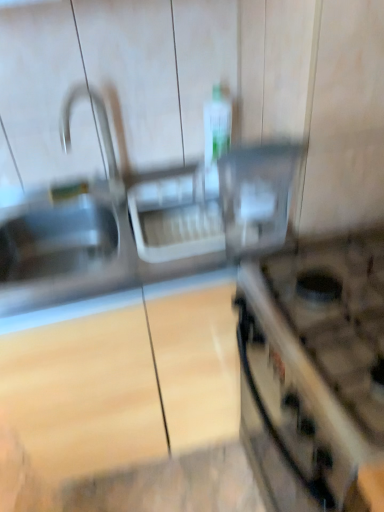
Question: Does clear plastic container at center turn towards satin nickel faucet at upper left?

Choices:
 (A) yes
 (B) no

Answer: (B)

Question: Can you confirm if clear plastic container at center is positioned to the right of satin nickel faucet at upper left?

Choices:
 (A) yes
 (B) no

Answer: (A)

Question: Does clear plastic container at center appear on the left side of satin nickel faucet at upper left?

Choices:
 (A) no
 (B) yes

Answer: (A)

Question: Considering the relative sizes of clear plastic container at center and satin nickel faucet at upper left in the image provided, is clear plastic container at center shorter than satin nickel faucet at upper left?

Choices:
 (A) yes
 (B) no

Answer: (A)

Question: Is clear plastic container at center next to satin nickel faucet at upper left and touching it?

Choices:
 (A) yes
 (B) no

Answer: (B)

Question: Is clear plastic container at center in front of or behind satin nickel faucet at upper left in the image?

Choices:
 (A) front
 (B) behind

Answer: (A)

Question: From the image's perspective, is clear plastic container at center positioned above or below satin nickel faucet at upper left?

Choices:
 (A) below
 (B) above

Answer: (A)

Question: Looking at their shapes, would you say clear plastic container at center is wider or thinner than satin nickel faucet at upper left?

Choices:
 (A) thin
 (B) wide

Answer: (A)

Question: Is clear plastic container at center situated inside satin nickel faucet at upper left or outside?

Choices:
 (A) inside
 (B) outside

Answer: (B)

Question: Would you say satin nickel faucet at upper left is to the left or to the right of translucent plastic bottle at center in the picture?

Choices:
 (A) left
 (B) right

Answer: (A)

Question: Considering the positions of satin nickel faucet at upper left and translucent plastic bottle at center in the image, is satin nickel faucet at upper left taller or shorter than translucent plastic bottle at center?

Choices:
 (A) tall
 (B) short

Answer: (A)

Question: From the image's perspective, is satin nickel faucet at upper left located above or below translucent plastic bottle at center?

Choices:
 (A) above
 (B) below

Answer: (B)

Question: From a real-world perspective, is satin nickel faucet at upper left physically located above or below translucent plastic bottle at center?

Choices:
 (A) above
 (B) below

Answer: (A)

Question: From the image's perspective, is translucent plastic bottle at center above or below satin nickel faucet at upper left?

Choices:
 (A) above
 (B) below

Answer: (A)

Question: Choose the correct answer: Is translucent plastic bottle at center inside satin nickel faucet at upper left or outside it?

Choices:
 (A) outside
 (B) inside

Answer: (A)